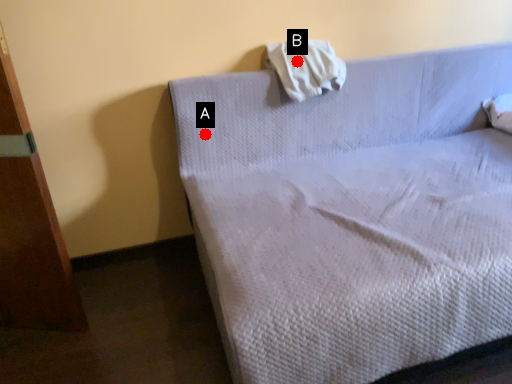
Question: Two points are circled on the image, labeled by A and B beside each circle. Which point is farther from the camera taking this photo?

Choices:
 (A) A is further
 (B) B is further

Answer: (A)